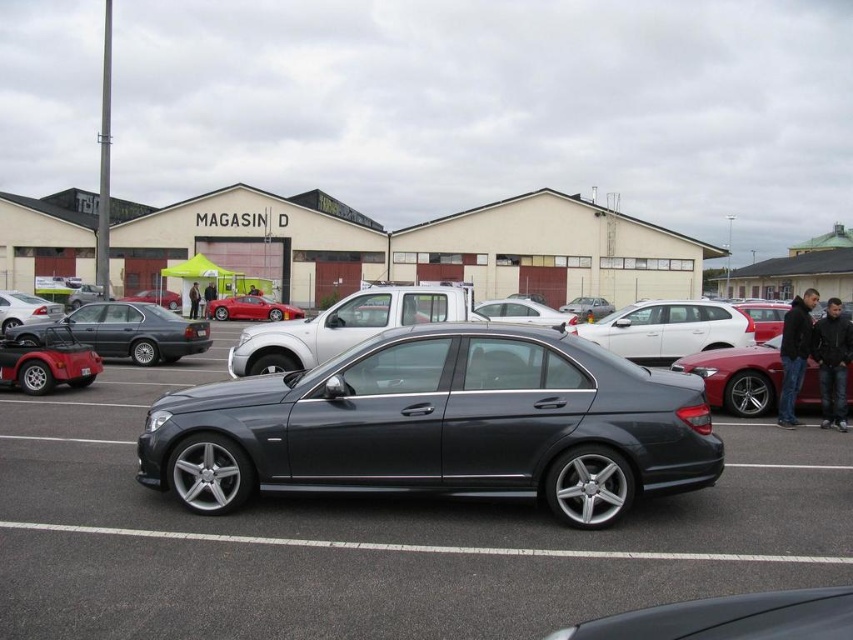
You are standing at the entrance of MAGASIN D and see the point marked at coordinates (125, 332). What object does this point correspond to?

The point at coordinates (125, 332) corresponds to the matte gray sedan at left.

You are a delivery driver trying to park your truck in the parking lot near the MAGASIN D building. You notice a metallic gray sedan at right and a dark gray car at center. Which vehicle should you avoid parking next to if you need extra space for maneuvering?

The metallic gray sedan at right might be wider than dark gray car at center, so you should avoid parking next to the metallic gray sedan at right to have enough space for maneuvering.

You are standing in the parking lot in front of MAGASIN D and see a point at coordinates (833,362). What object is this point located on?

The point at coordinates (833,362) is located on the dark gray leather jacket at lower right.